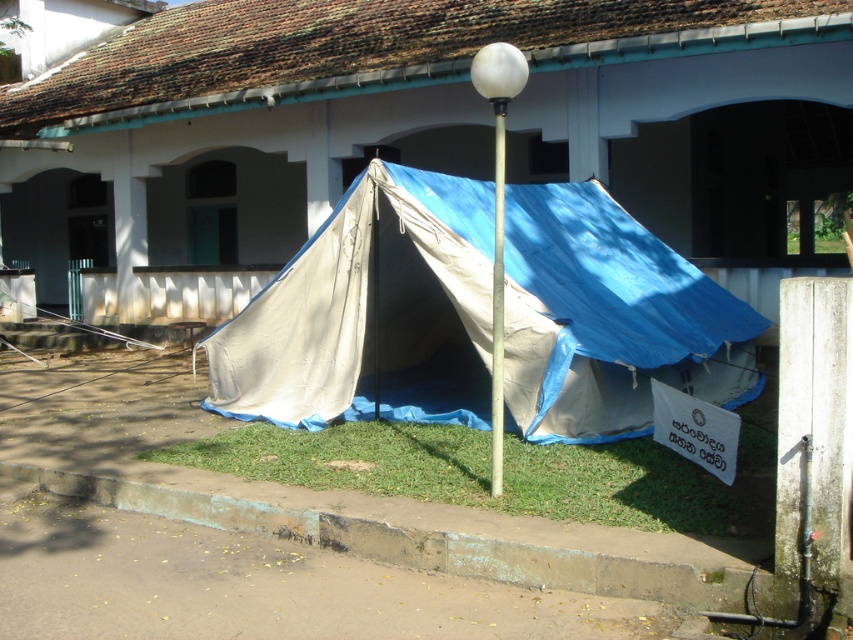
Question: Can you confirm if blue tarpaulin tent at center is wider than green grass at lower center?

Choices:
 (A) yes
 (B) no

Answer: (A)

Question: Is the position of blue tarpaulin tent at center less distant than that of green grass at lower center?

Choices:
 (A) no
 (B) yes

Answer: (A)

Question: Which object is positioned closest to the green grass at lower center?

Choices:
 (A) blue tarpaulin tent at center
 (B) white plastic pole at center

Answer: (A)

Question: Which object appears closest to the camera in this image?

Choices:
 (A) white plastic pole at center
 (B) blue tarpaulin tent at center

Answer: (A)

Question: Does blue tarpaulin tent at center appear over white plastic pole at center?

Choices:
 (A) no
 (B) yes

Answer: (A)

Question: Which point appears farthest from the camera in this image?

Choices:
 (A) (498, 406)
 (B) (283, 445)

Answer: (B)